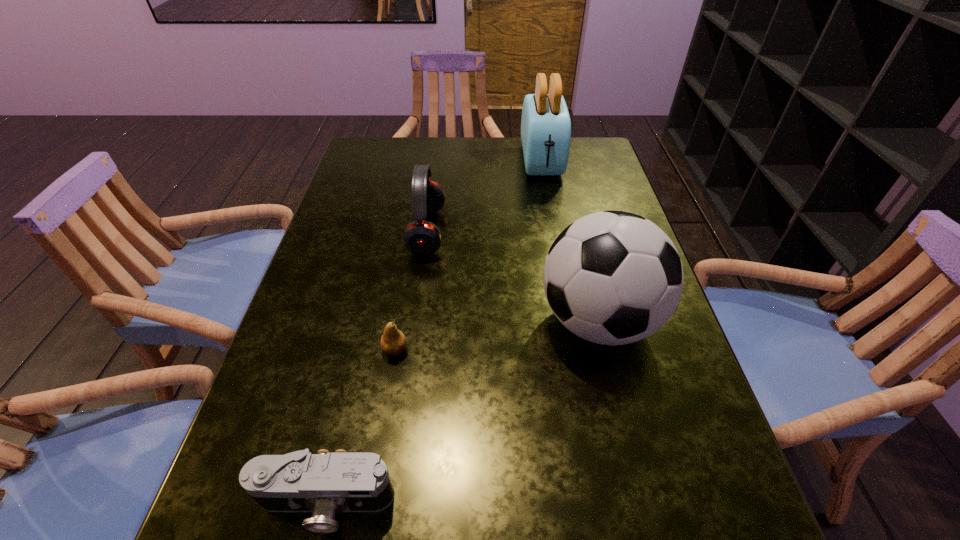
The width and height of the screenshot is (960, 540). In order to click on toaster in this screenshot , I will do `click(545, 125)`.

Where is `soccer ball`? The image size is (960, 540). soccer ball is located at coordinates (613, 277).

Locate an element on the screen. The width and height of the screenshot is (960, 540). the third shortest object is located at coordinates (421, 237).

At what (x,y) coordinates should I click in order to perform the action: click on the fourth nearest object. Please return your answer as a coordinate pair (x, y). This screenshot has width=960, height=540. Looking at the image, I should click on [421, 237].

You are a GUI agent. You are given a task and a screenshot of the screen. Output one action in this format:
    pyautogui.click(x=<x>, y=<y>)
    Task: Click on the pear
    This screenshot has height=540, width=960.
    Given the screenshot: What is the action you would take?
    pyautogui.click(x=393, y=342)

What are the coordinates of `the nearest object` in the screenshot? It's located at (326, 483).

At what (x,y) coordinates should I click in order to perform the action: click on blank area located 0.090m on the side of the toaster with the lever. Please return your answer as a coordinate pair (x, y). The height and width of the screenshot is (540, 960). Looking at the image, I should click on (549, 201).

Where is `vacant space located 0.070m on the front of the soccer ball`? The image size is (960, 540). vacant space located 0.070m on the front of the soccer ball is located at coordinates (619, 407).

Identify the location of free point located on the ear cups of the third tallest object. The height and width of the screenshot is (540, 960). (x=567, y=231).

Locate an element on the screen. The image size is (960, 540). vacant position located 0.290m on the back of the pear is located at coordinates (413, 245).